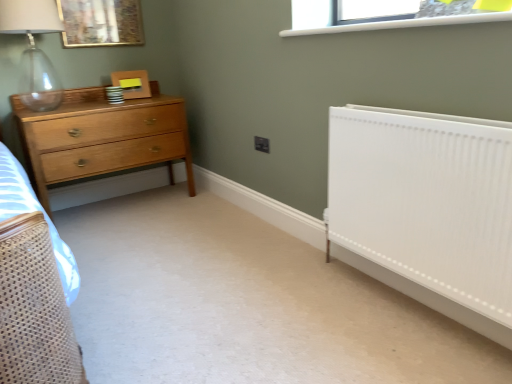
Question: From a real-world perspective, is white smooth radiator at right under clear glass window at upper center?

Choices:
 (A) yes
 (B) no

Answer: (A)

Question: From the image's perspective, is white smooth radiator at right below clear glass window at upper center?

Choices:
 (A) no
 (B) yes

Answer: (B)

Question: Does white smooth radiator at right have a smaller size compared to clear glass window at upper center?

Choices:
 (A) no
 (B) yes

Answer: (A)

Question: Is white smooth radiator at right at the right side of clear glass window at upper center?

Choices:
 (A) no
 (B) yes

Answer: (B)

Question: Does white smooth radiator at right have a larger size compared to clear glass window at upper center?

Choices:
 (A) yes
 (B) no

Answer: (A)

Question: From the image's perspective, is light brown wood chest of drawers at left located above or below gold-framed picture at upper left?

Choices:
 (A) below
 (B) above

Answer: (A)

Question: Considering the positions of light brown wood chest of drawers at left and gold-framed picture at upper left in the image, is light brown wood chest of drawers at left wider or thinner than gold-framed picture at upper left?

Choices:
 (A) wide
 (B) thin

Answer: (A)

Question: Would you say light brown wood chest of drawers at left is to the left or to the right of gold-framed picture at upper left in the picture?

Choices:
 (A) right
 (B) left

Answer: (A)

Question: From their relative heights in the image, would you say light brown wood chest of drawers at left is taller or shorter than gold-framed picture at upper left?

Choices:
 (A) tall
 (B) short

Answer: (A)

Question: Is transparent glass lamp at upper left to the left or to the right of clear glass window at upper center in the image?

Choices:
 (A) right
 (B) left

Answer: (B)

Question: From the image's perspective, relative to clear glass window at upper center, is transparent glass lamp at upper left above or below?

Choices:
 (A) above
 (B) below

Answer: (A)

Question: Looking at the image, does transparent glass lamp at upper left seem bigger or smaller compared to clear glass window at upper center?

Choices:
 (A) small
 (B) big

Answer: (B)

Question: Do you think transparent glass lamp at upper left is within clear glass window at upper center, or outside of it?

Choices:
 (A) inside
 (B) outside

Answer: (B)

Question: Is gold-framed picture at upper left inside or outside of clear glass window at upper center?

Choices:
 (A) outside
 (B) inside

Answer: (A)

Question: From a real-world perspective, relative to clear glass window at upper center, is gold-framed picture at upper left vertically above or below?

Choices:
 (A) below
 (B) above

Answer: (B)